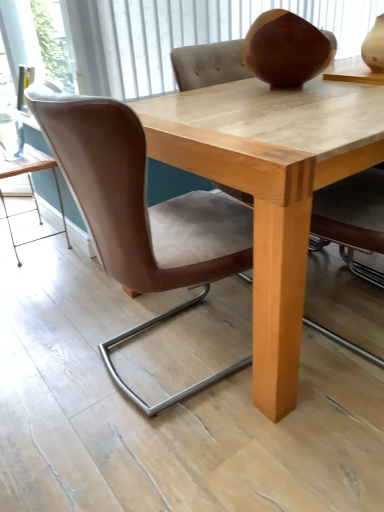
Question: Considering the relative sizes of transparent glass door at upper left and light brown wood table at lower left in the image provided, is transparent glass door at upper left shorter than light brown wood table at lower left?

Choices:
 (A) yes
 (B) no

Answer: (A)

Question: Is light brown wood table at lower left surrounded by transparent glass door at upper left?

Choices:
 (A) no
 (B) yes

Answer: (A)

Question: From a real-world perspective, is transparent glass door at upper left physically below light brown wood table at lower left?

Choices:
 (A) no
 (B) yes

Answer: (A)

Question: Is transparent glass door at upper left turned away from light brown wood table at lower left?

Choices:
 (A) no
 (B) yes

Answer: (A)

Question: Can you confirm if transparent glass door at upper left is bigger than light brown wood table at lower left?

Choices:
 (A) yes
 (B) no

Answer: (B)

Question: Does transparent glass door at upper left have a smaller size compared to light brown wood table at lower left?

Choices:
 (A) no
 (B) yes

Answer: (B)

Question: Is there a large distance between light brown wood table at lower left and brown leather chair at center?

Choices:
 (A) yes
 (B) no

Answer: (A)

Question: Does light brown wood table at lower left have a greater width compared to brown leather chair at center?

Choices:
 (A) no
 (B) yes

Answer: (A)

Question: Is light brown wood table at lower left shorter than brown leather chair at center?

Choices:
 (A) no
 (B) yes

Answer: (B)

Question: Does light brown wood table at lower left have a smaller size compared to brown leather chair at center?

Choices:
 (A) yes
 (B) no

Answer: (A)

Question: From the image's perspective, is light brown wood table at lower left beneath brown leather chair at center?

Choices:
 (A) no
 (B) yes

Answer: (A)

Question: Is light brown wood table at lower left at the left side of brown leather chair at center?

Choices:
 (A) yes
 (B) no

Answer: (A)

Question: Considering the relative positions of brown leather chair at center and light brown wood table at lower left in the image provided, is brown leather chair at center behind light brown wood table at lower left?

Choices:
 (A) no
 (B) yes

Answer: (A)